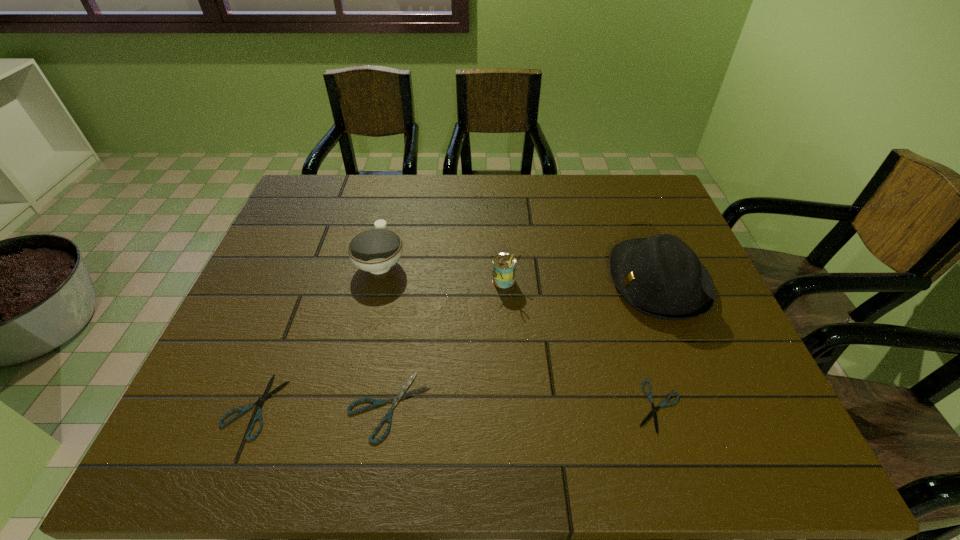
This screenshot has width=960, height=540. What are the coordinates of `the leftmost shears` in the screenshot? It's located at (265, 396).

At what (x,y) coordinates should I click in order to perform the action: click on the leftmost object. Please return your answer as a coordinate pair (x, y). The width and height of the screenshot is (960, 540). Looking at the image, I should click on (265, 396).

This screenshot has height=540, width=960. I want to click on the second shears from right to left, so click(x=400, y=395).

Where is `the rightmost shears`? The height and width of the screenshot is (540, 960). the rightmost shears is located at coordinates (654, 409).

Where is `the shortest object`? This screenshot has width=960, height=540. the shortest object is located at coordinates (654, 409).

At what (x,y) coordinates should I click in order to perform the action: click on chinaware. Please return your answer as a coordinate pair (x, y). Looking at the image, I should click on [376, 250].

The width and height of the screenshot is (960, 540). I want to click on the second tallest object, so click(x=504, y=264).

The height and width of the screenshot is (540, 960). I want to click on can, so click(504, 264).

Locate an element on the screen. fedora is located at coordinates (661, 277).

Locate an element on the screen. The height and width of the screenshot is (540, 960). free location located 0.130m on the back of the second shortest object is located at coordinates (285, 328).